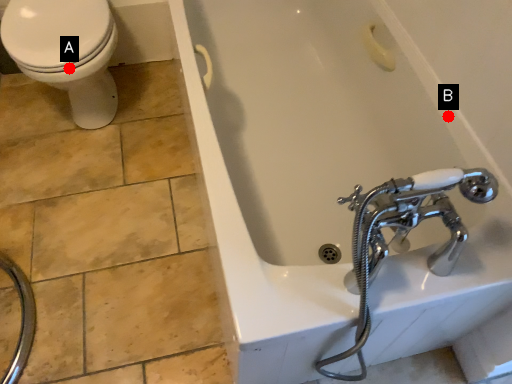
Question: Two points are circled on the image, labeled by A and B beside each circle. Among these points, which one is farthest from the camera?

Choices:
 (A) A is further
 (B) B is further

Answer: (A)